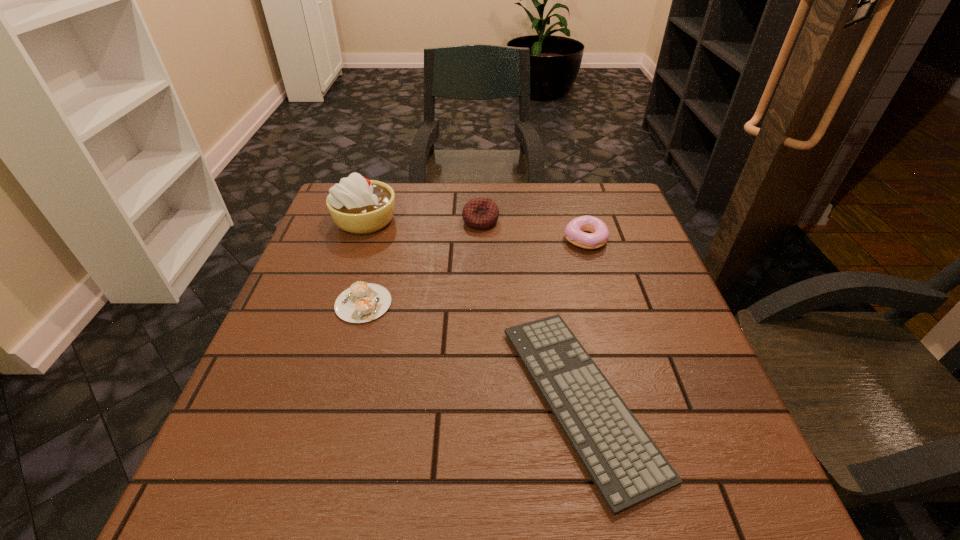
You are a GUI agent. You are given a task and a screenshot of the screen. Output one action in this format:
    pyautogui.click(x=<x>, y=<y>)
    Task: Click on the whipped cream that is at the far edge
    The width and height of the screenshot is (960, 540).
    Given the screenshot: What is the action you would take?
    pyautogui.click(x=357, y=205)

Find the location of `beanbag located at the far edge`. beanbag located at the far edge is located at coordinates (480, 213).

The height and width of the screenshot is (540, 960). In order to click on doughnut situated at the far edge in this screenshot , I will do `click(575, 230)`.

Locate an element on the screen. Image resolution: width=960 pixels, height=540 pixels. object located in the near edge section of the desktop is located at coordinates (x=626, y=466).

You are a GUI agent. You are given a task and a screenshot of the screen. Output one action in this format:
    pyautogui.click(x=<x>, y=<y>)
    Task: Click on the whipped cream that is at the left edge
    
    Given the screenshot: What is the action you would take?
    pyautogui.click(x=357, y=205)

Locate an element on the screen. The height and width of the screenshot is (540, 960). cappuccino located in the left edge section of the desktop is located at coordinates click(x=363, y=302).

I want to click on doughnut present at the right edge, so click(x=575, y=230).

You are a GUI agent. You are given a task and a screenshot of the screen. Output one action in this format:
    pyautogui.click(x=<x>, y=<y>)
    Task: Click on the computer keyboard that is at the right edge
    The height and width of the screenshot is (540, 960).
    Given the screenshot: What is the action you would take?
    pyautogui.click(x=626, y=466)

What are the coordinates of `object present at the far left corner` in the screenshot? It's located at (357, 205).

Locate an element on the screen. Image resolution: width=960 pixels, height=540 pixels. object positioned at the far right corner is located at coordinates (575, 230).